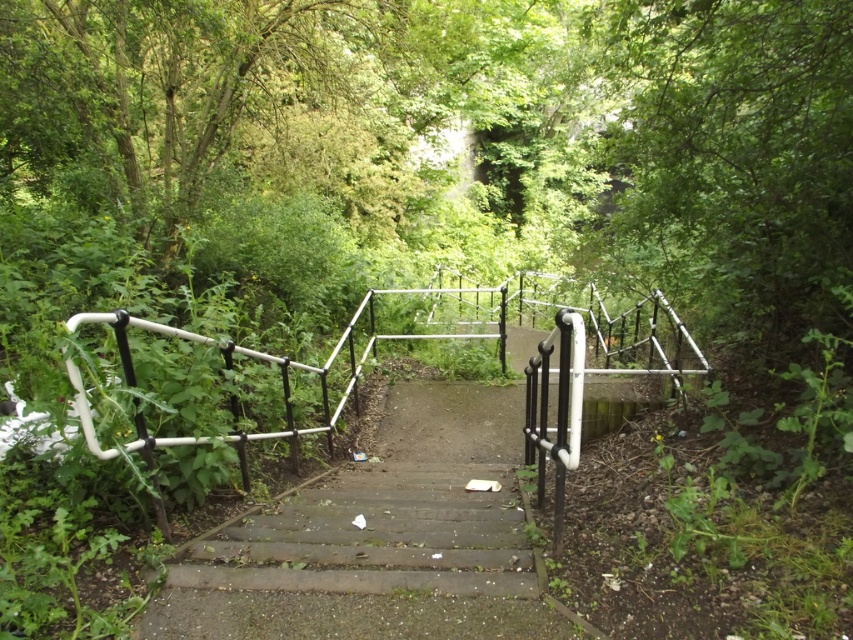
You are a hiker who wants to take a photo of the wooden stairs at center from the top of the green leafy tree at upper left. Is the tree tall enough to provide a good vantage point for this photo?

The green leafy tree at upper left is much taller than the wooden stairs at center, so yes, the tree is tall enough to provide a good vantage point for taking a photo of the wooden stairs at center from above.

You are standing on the wooden stairs at center and want to reach the green leafy tree at upper left. Which direction should you move to get closer to the tree?

The green leafy tree at upper left is located at the upper left direction from the wooden stairs at center, so you should move towards the upper left direction to get closer.